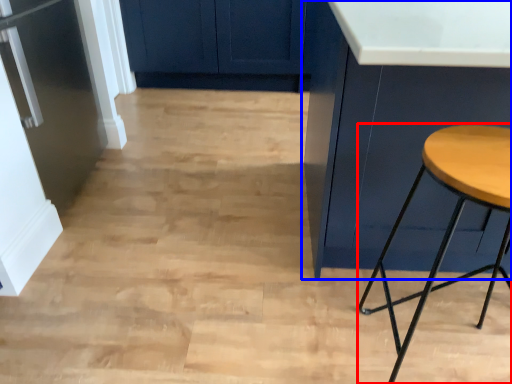
Question: Which object appears farthest to the camera in this image, stool (highlighted by a red box) or cabinetry (highlighted by a blue box)?

Choices:
 (A) stool
 (B) cabinetry

Answer: (B)